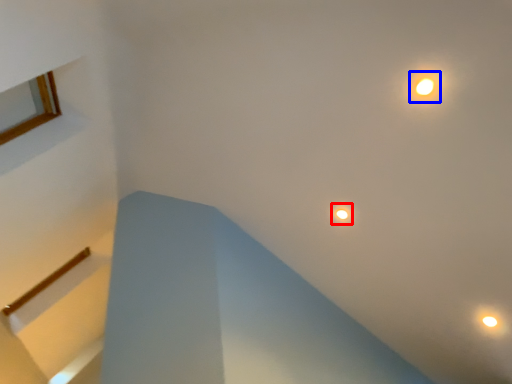
Question: Which of the following is the farthest to the observer, droplight (highlighted by a red box) or light (highlighted by a blue box)?

Choices:
 (A) droplight
 (B) light

Answer: (A)